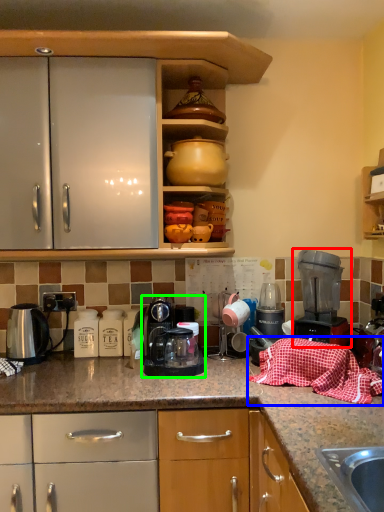
Question: Which is farther away from home appliance (highlighted by a red box)? blanket (highlighted by a blue box) or kitchen appliance (highlighted by a green box)?

Choices:
 (A) blanket
 (B) kitchen appliance

Answer: (B)